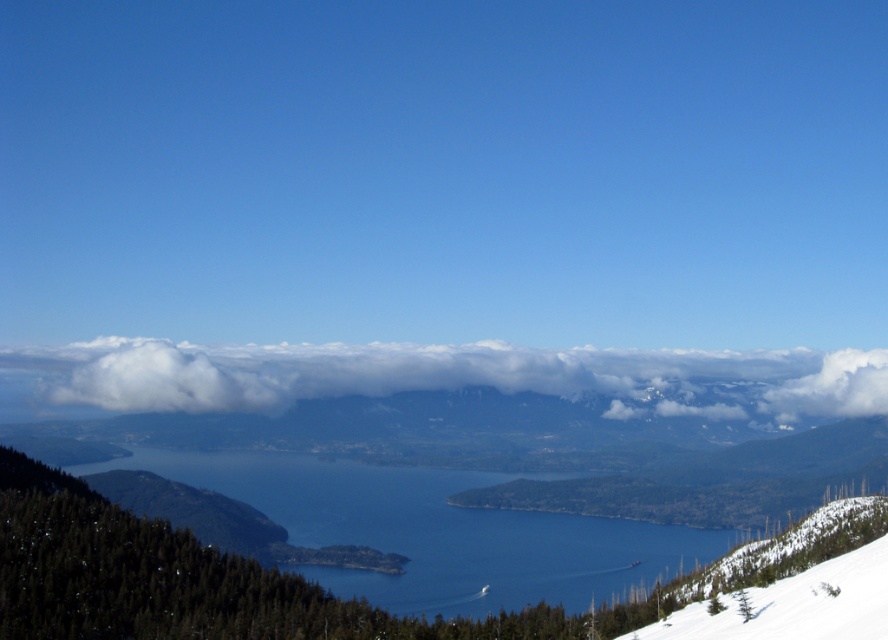
Question: Considering the relative positions of white fluffy cloud at upper center and blue water at center in the image provided, where is white fluffy cloud at upper center located with respect to blue water at center?

Choices:
 (A) right
 (B) left

Answer: (B)

Question: Can you confirm if white fluffy cloud at upper center is bigger than blue water at center?

Choices:
 (A) yes
 (B) no

Answer: (B)

Question: In this image, where is white fluffy cloud at upper center located relative to blue water at center?

Choices:
 (A) below
 (B) above

Answer: (B)

Question: Among these objects, which one is farthest from the camera?

Choices:
 (A) white fluffy cloud at upper center
 (B) blue water at center

Answer: (A)